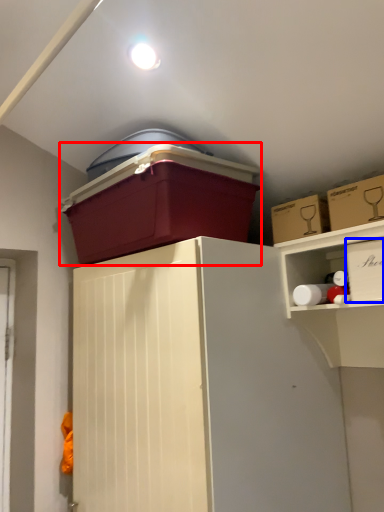
Question: Which of the following is the closest to the observer, storage box (highlighted by a red box) or storage box (highlighted by a blue box)?

Choices:
 (A) storage box
 (B) storage box

Answer: (B)